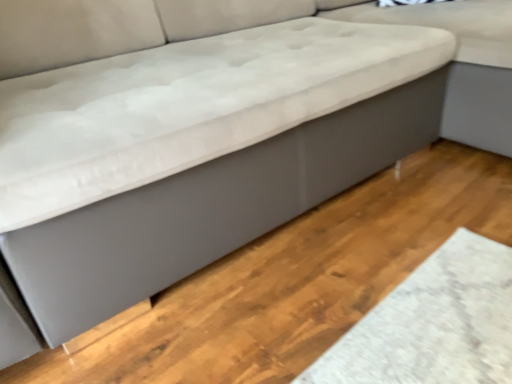
I want to click on white fabric couch at center, so click(460, 62).

Describe the element at coordinates (460, 62) in the screenshot. I see `white fabric couch at center` at that location.

The height and width of the screenshot is (384, 512). I want to click on white fabric couch at center, so click(460, 62).